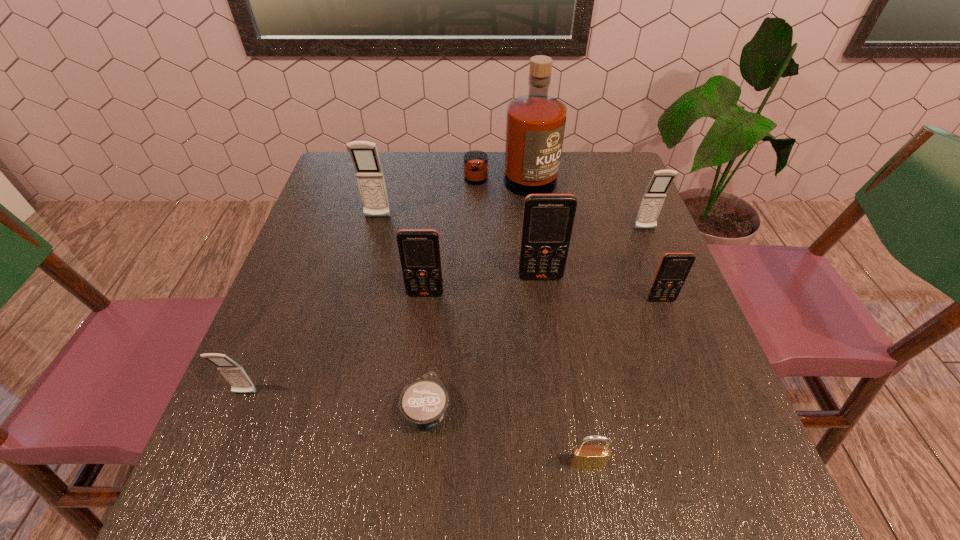
The height and width of the screenshot is (540, 960). In order to click on free spot that satisfies the following two spatial constraints: 1. on the front-facing side of the farthest cellular telephone; 2. on the left side of the yogurt in this screenshot , I will do `click(327, 410)`.

Locate an element on the screen. This screenshot has height=540, width=960. vacant position in the image that satisfies the following two spatial constraints: 1. on the front-facing side of the leftmost cellular telephone; 2. on the right side of the shortest object is located at coordinates (238, 410).